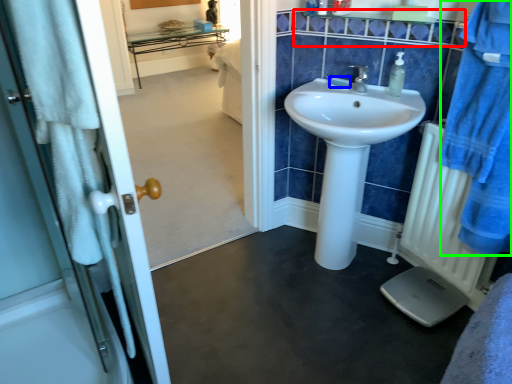
Question: Based on their relative distances, which object is farther from balustrade (highlighted by a red box)? Choose from soap (highlighted by a blue box) and bathrobe (highlighted by a green box).

Choices:
 (A) soap
 (B) bathrobe

Answer: (B)